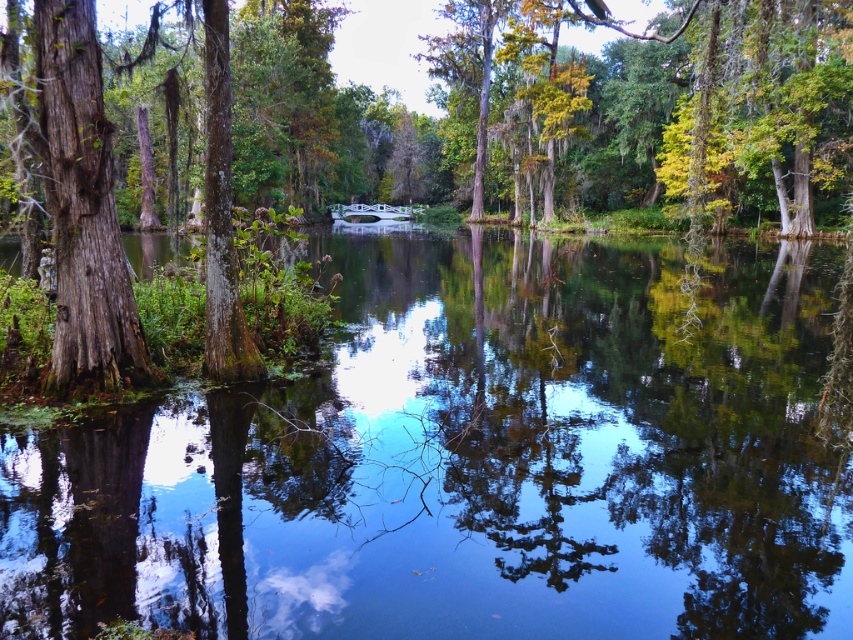
You are a hiker who wants to cross the swamp using the white glossy bridge at center. However, you notice the clear water at center below it. Is the bridge above or below the water?

The white glossy bridge at center is above the clear water at center because the clear water at center is positioned under the white glossy bridge at center.

You are a photographer planning to capture the reflection of the white glossy bridge at center in the clear water at center. Based on the scene, will the reflection of the bridge be fully visible in the water?

The clear water at center has a larger size compared to white glossy bridge at center, so the reflection of the white glossy bridge at center should be fully visible within the clear water at center since the water area is bigger than the bridge.

You are standing on the edge of the swamp and want to throw a small stone into the clear water at center. However, there is a smooth bark tree at center blocking your direct path. Can you still throw the stone into the water without hitting the tree?

The clear water at center has a lesser width compared to the smooth bark tree at center, meaning the tree is wider. Since the tree is wider, it might block more of the path, making it harder to throw the stone into the water without hitting the tree. You might need to adjust your angle or aim around the tree.